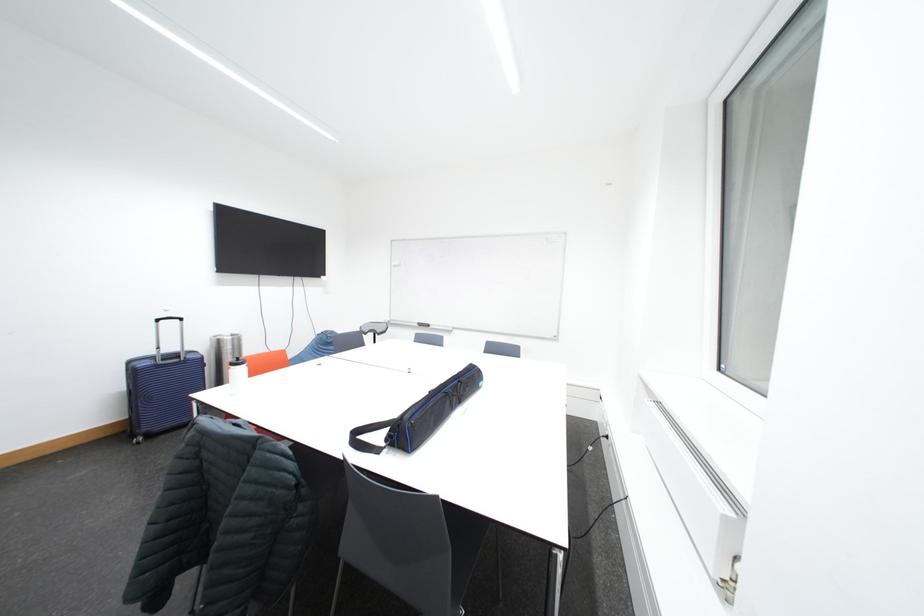
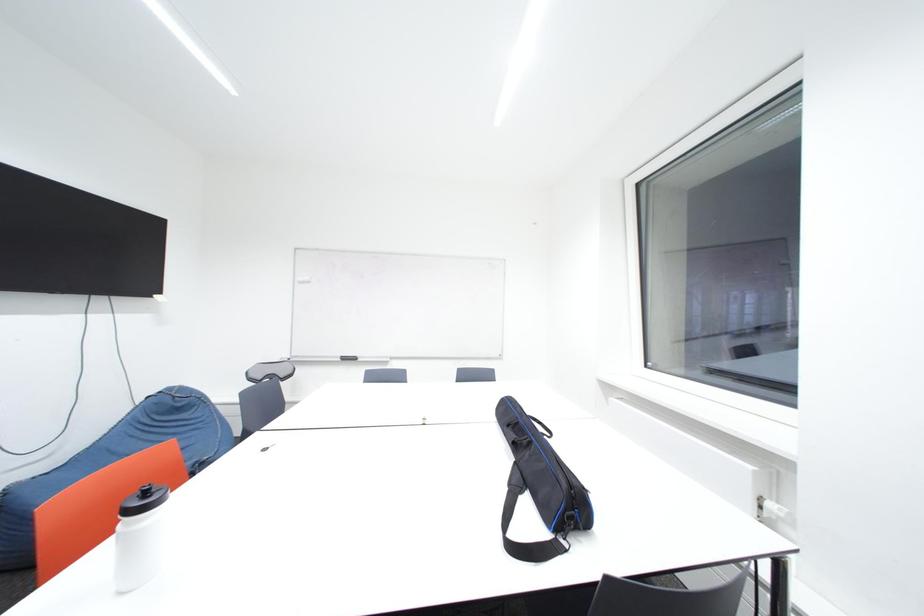
Question: Based on the continuous images, in which direction is the camera rotating? Reply with the corresponding letter.

Choices:
 (A) Left
 (B) Right
 (C) Up
 (D) Down

Answer: (B)